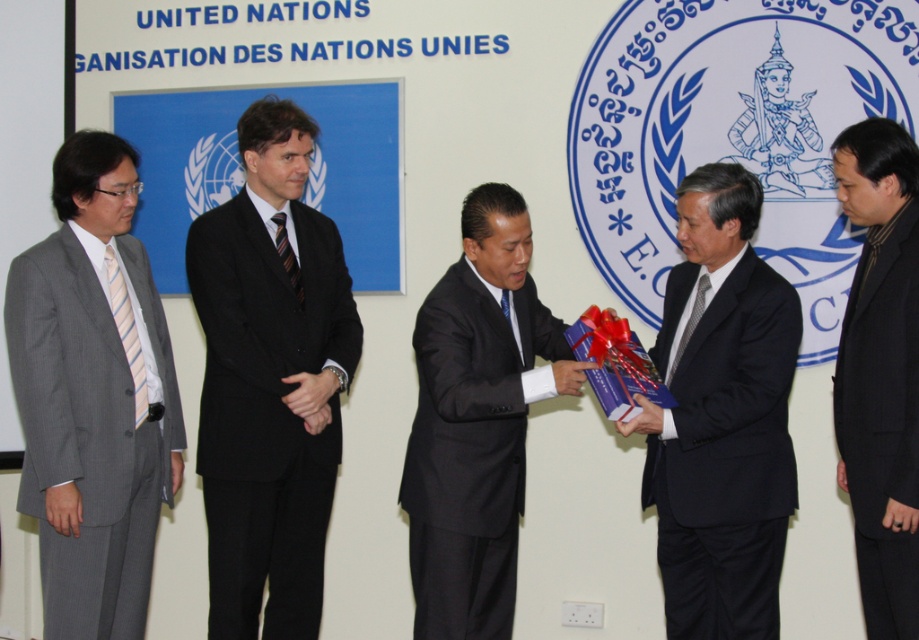
You are a photographer at the UN event. You need to position yourself so that both the gift box at point (293, 168) and the recipient at point (301, 300) are clearly visible in your shot. Based on their positions, which object should be closer to the camera?

Point (293, 168) is in front of point (301, 300), so the gift box at point (293, 168) should be closer to the camera.

You are an event planner at the UN who needs to arrange a photo for the official record. You must ensure that the black pinstripe suit at center and the striped fabric tie at center are both visible in the frame. Given their current positions, will you need to adjust the camera angle to include both?

The black pinstripe suit at center is positioned under the striped fabric tie at center, so adjusting the camera angle slightly upward might be necessary to ensure both are visible in the frame.

You are a photographer at the event and need to ensure that the black pinstripe suit at center and the striped fabric tie at center are both visible in the photo. Which object should you focus on to ensure both are in frame?

You should focus on the black pinstripe suit at center because it is wider than the striped fabric tie at center, ensuring both are captured in the frame.